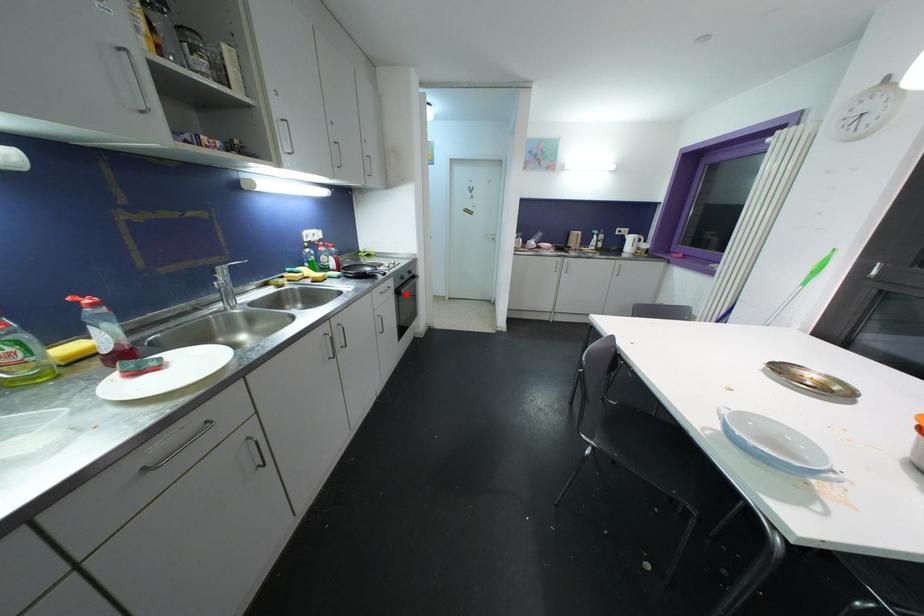
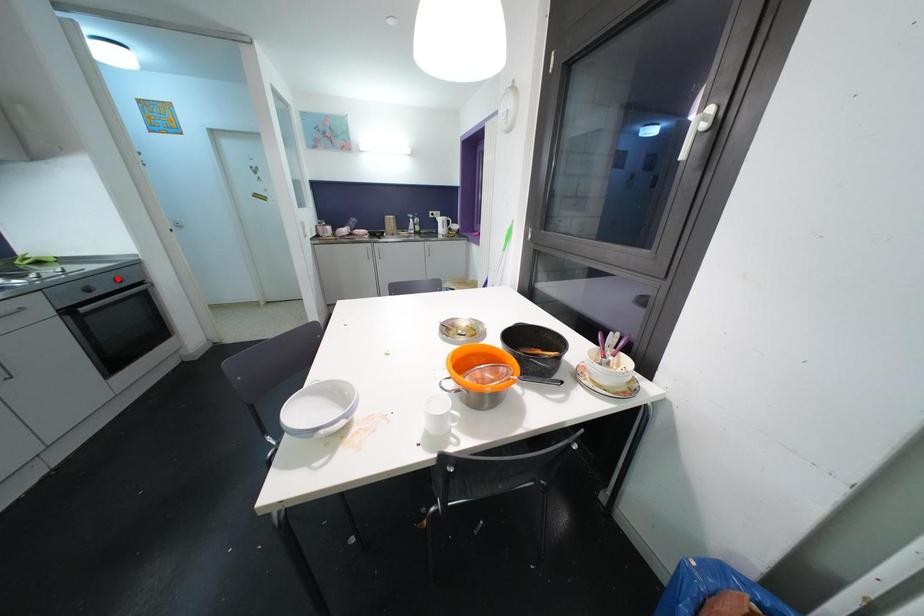
I am providing you with two images of the same scene from different viewpoints. A red point is marked on the first image and another point is marked on the second image. Are the points marked in image1 and image2 representing the same 3D position?

No